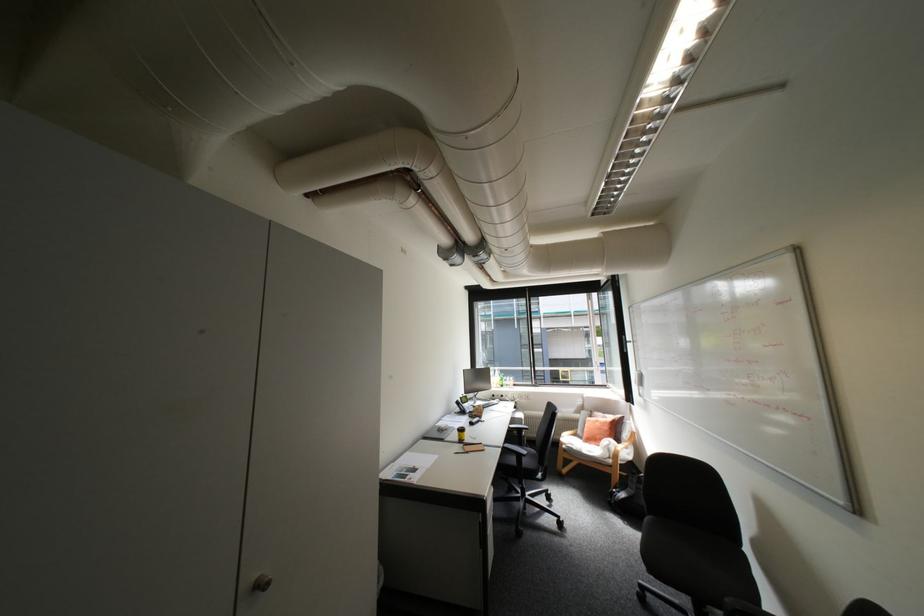
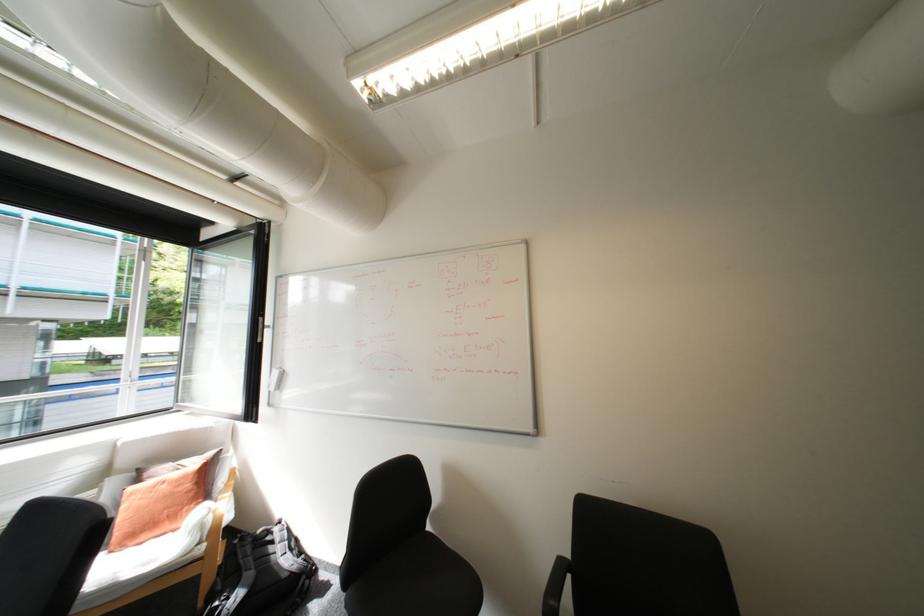
Find the pixel in the second image that matches the point at 646,383 in the first image.

(277, 387)